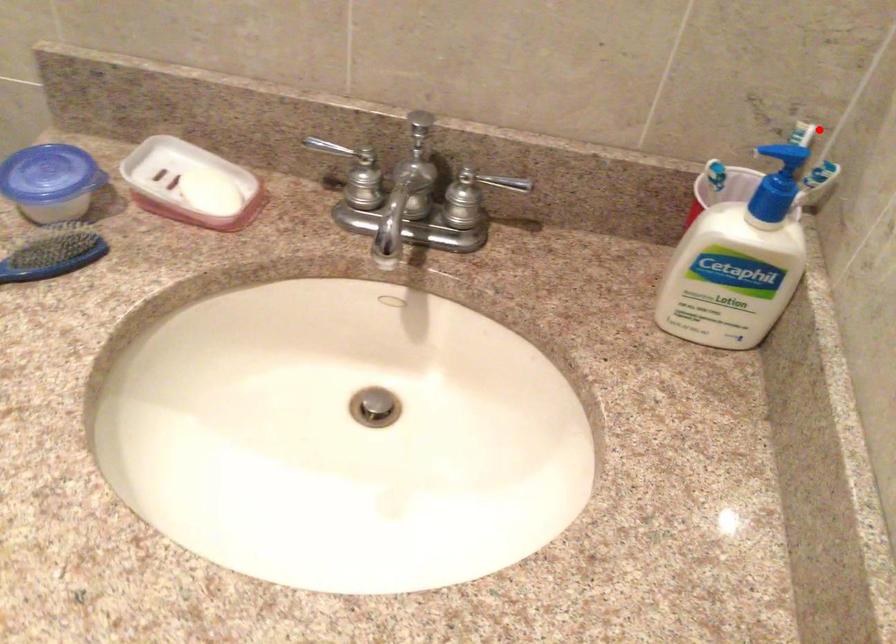
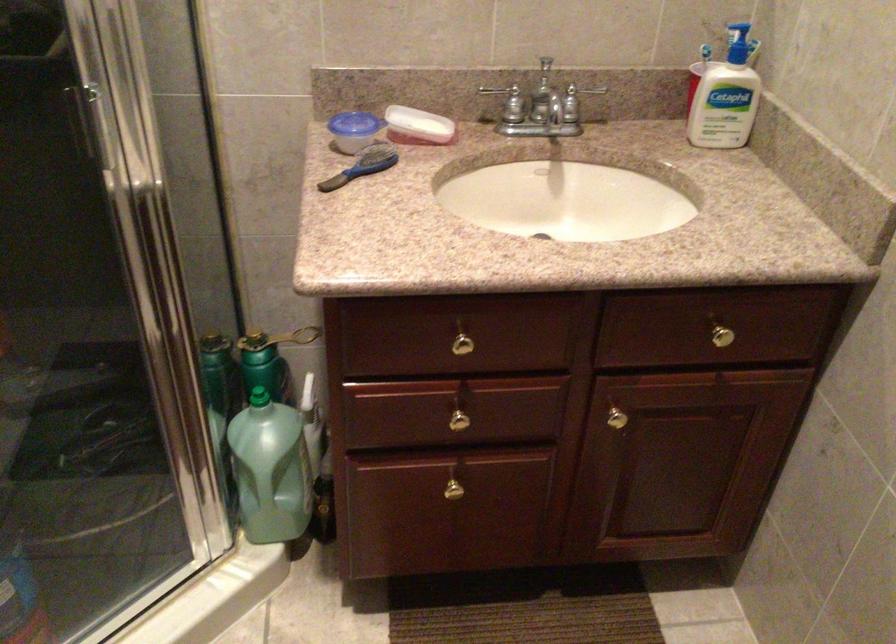
Locate, in the second image, the point that corresponds to the highlighted location in the first image.

(739, 35)